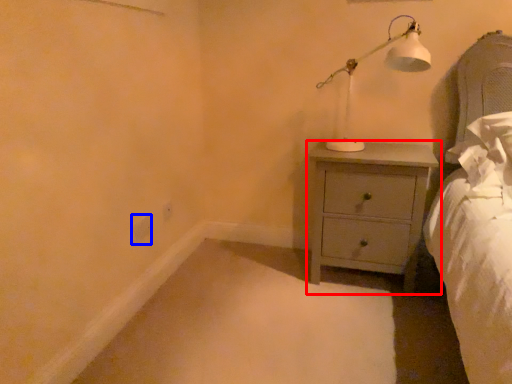
Question: Among these objects, which one is nearest to the camera, chest of drawers (highlighted by a red box) or electric outlet (highlighted by a blue box)?

Choices:
 (A) chest of drawers
 (B) electric outlet

Answer: (A)